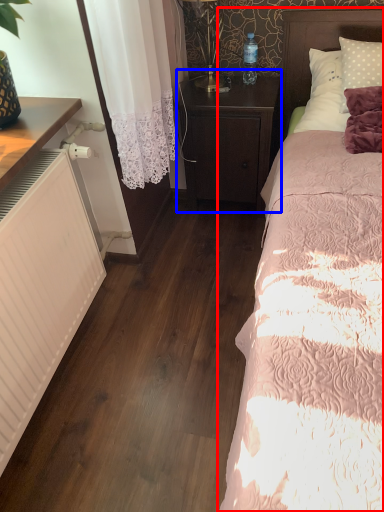
Question: Which object is closer to the camera taking this photo, bed (highlighted by a red box) or nightstand (highlighted by a blue box)?

Choices:
 (A) bed
 (B) nightstand

Answer: (A)